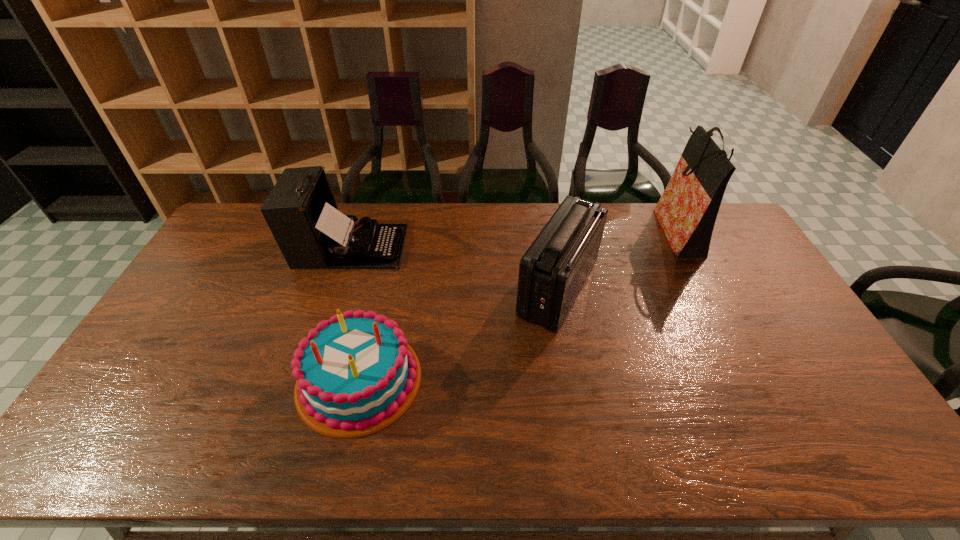
At what (x,y) coordinates should I click in order to perform the action: click on vacant space located on the front panel of the radio receiver. Please return your answer as a coordinate pair (x, y). Looking at the image, I should click on (417, 289).

Where is `free space located 0.280m on the front panel of the radio receiver`? This screenshot has width=960, height=540. free space located 0.280m on the front panel of the radio receiver is located at coordinates (426, 289).

Identify the location of vacant area located on the right of the birthday cake. (473, 380).

At what (x,y) coordinates should I click in order to perform the action: click on shopping bag present at the far edge. Please return your answer as a coordinate pair (x, y). This screenshot has width=960, height=540. Looking at the image, I should click on (687, 210).

You are a GUI agent. You are given a task and a screenshot of the screen. Output one action in this format:
    pyautogui.click(x=<x>, y=<y>)
    Task: Click on the typewriter located at the far edge
    The image size is (960, 540).
    Given the screenshot: What is the action you would take?
    pyautogui.click(x=301, y=212)

Where is `object that is at the near edge`? The image size is (960, 540). object that is at the near edge is located at coordinates (x=355, y=373).

Locate an element on the screen. object present at the right edge is located at coordinates (687, 210).

You are a GUI agent. You are given a task and a screenshot of the screen. Output one action in this format:
    pyautogui.click(x=<x>, y=<y>)
    Task: Click on the object situated at the far right corner
    The image size is (960, 540).
    Given the screenshot: What is the action you would take?
    pyautogui.click(x=687, y=210)

In the image, there is a desktop. Where is `free space at the far edge`? This screenshot has height=540, width=960. free space at the far edge is located at coordinates (631, 207).

Image resolution: width=960 pixels, height=540 pixels. In order to click on vacant space at the near edge of the desktop in this screenshot , I will do `click(527, 456)`.